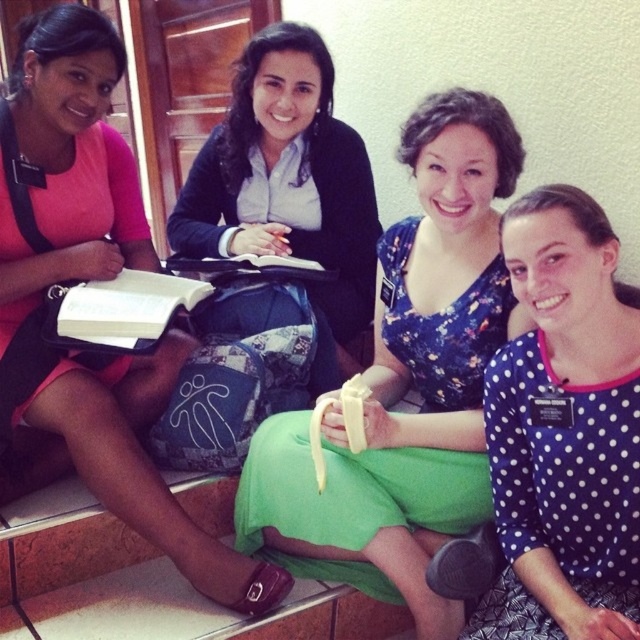
You are sitting at the back of the room and want to hand a note to the person closest to the front. Which of the two people, the pink matte shirt at upper left or the matte black sweater at center, should you target?

The pink matte shirt at upper left is closer to the viewer than the matte black sweater at center, so you should target the pink matte shirt at upper left to hand the note to the person closest to the front.

You are standing in front of the image and want to know the position of the blue polka dot shirt at center relative to the other objects. Can you tell me where it is located?

The blue polka dot shirt at center is located at point (564, 432).

Based on the scene description, which object is taller between the pink matte shirt at upper left and the matte black sweater at center?

The pink matte shirt at upper left is taller than the matte black sweater at center.